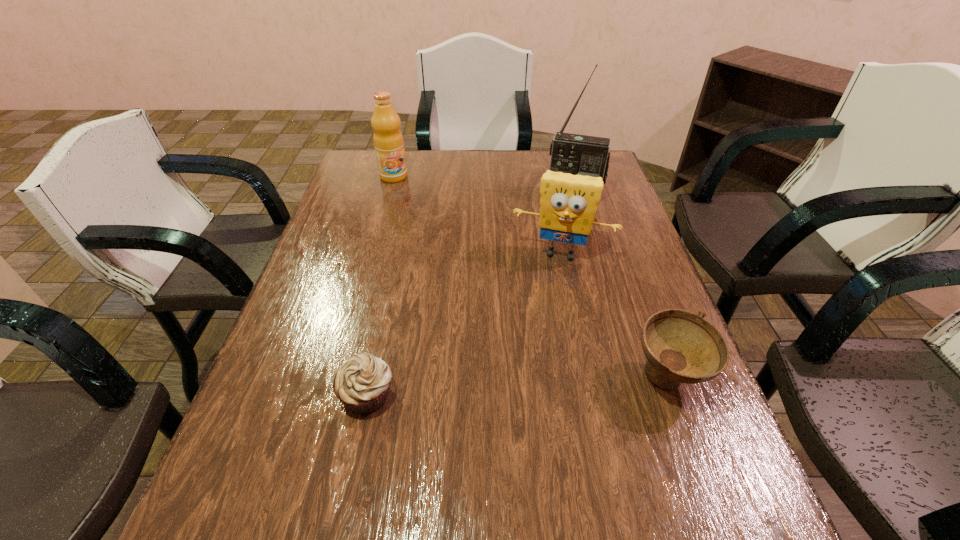
Identify the location of vacant point that satisfies the following two spatial constraints: 1. on the back side of the shortest object; 2. on the right side of the second shortest object. The image size is (960, 540). (371, 379).